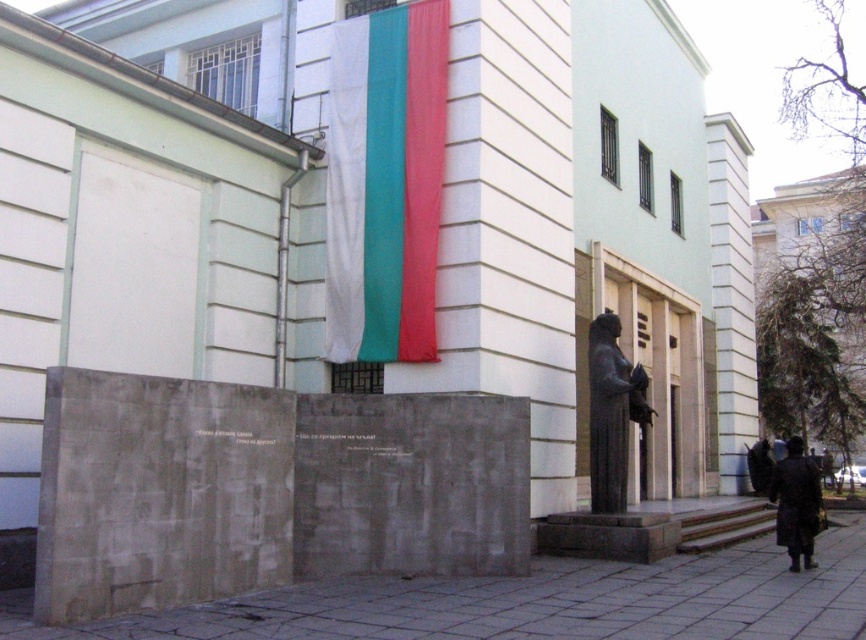
Between point (611, 333) and point (815, 528), which one is positioned in front?

Point (815, 528) is in front.

Does black polished statue at right appear over dark brown leather coat at lower right?

Indeed, black polished statue at right is positioned over dark brown leather coat at lower right.

You are a GUI agent. You are given a task and a screenshot of the screen. Output one action in this format:
    pyautogui.click(x=<x>, y=<y>)
    Task: Click on the black polished statue at right
    The height and width of the screenshot is (640, 866).
    Given the screenshot: What is the action you would take?
    pyautogui.click(x=611, y=412)

Can you confirm if gray concrete pavement at lower center is bigger than dark brown leather coat at lower right?

Incorrect, gray concrete pavement at lower center is not larger than dark brown leather coat at lower right.

Does point (863, 532) come closer to viewer compared to point (810, 541)?

That is False.

Identify the location of gray concrete pavement at lower center. click(x=531, y=602).

Based on the photo, which is below, gray concrete pavement at lower center or black polished statue at right?

gray concrete pavement at lower center is below.

Does gray concrete pavement at lower center appear under black polished statue at right?

Indeed, gray concrete pavement at lower center is positioned under black polished statue at right.

Is point (806, 614) positioned before point (589, 332)?

Yes, it is in front of point (589, 332).

Locate an element on the screen. The width and height of the screenshot is (866, 640). gray concrete pavement at lower center is located at coordinates (531, 602).